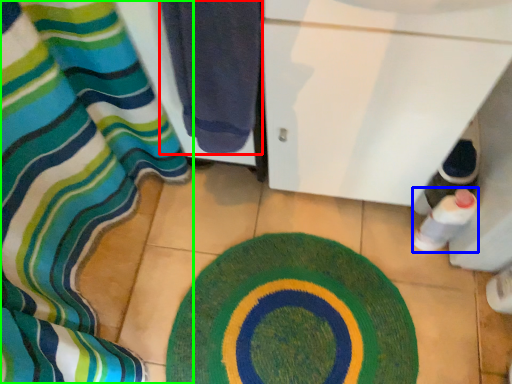
Question: Estimate the real-world distances between objects in this image. Which object is closer to towel (highlighted by a red box), bottle (highlighted by a blue box) or curtain (highlighted by a green box)?

Choices:
 (A) bottle
 (B) curtain

Answer: (B)